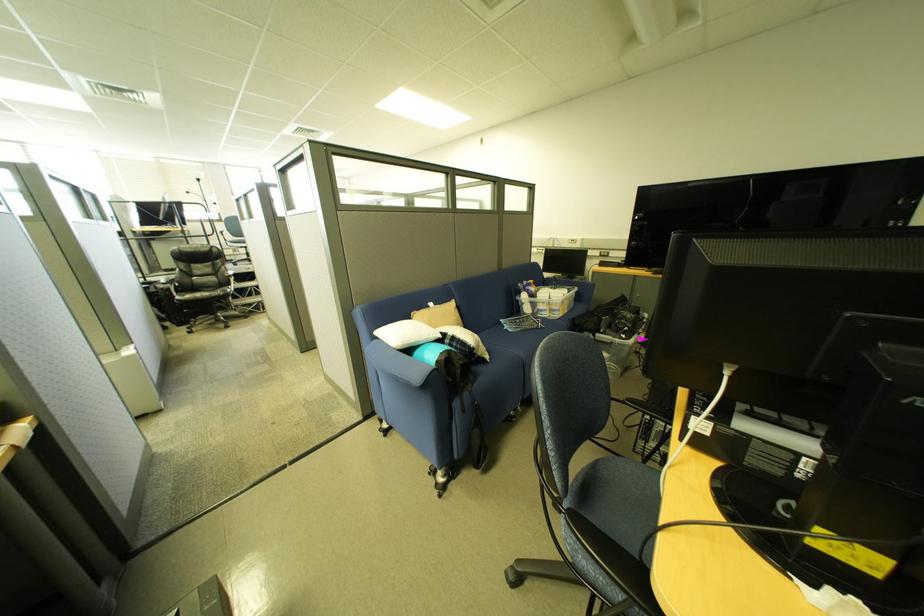
What do you see at coordinates (395, 367) in the screenshot? I see `a blue sofa armrest` at bounding box center [395, 367].